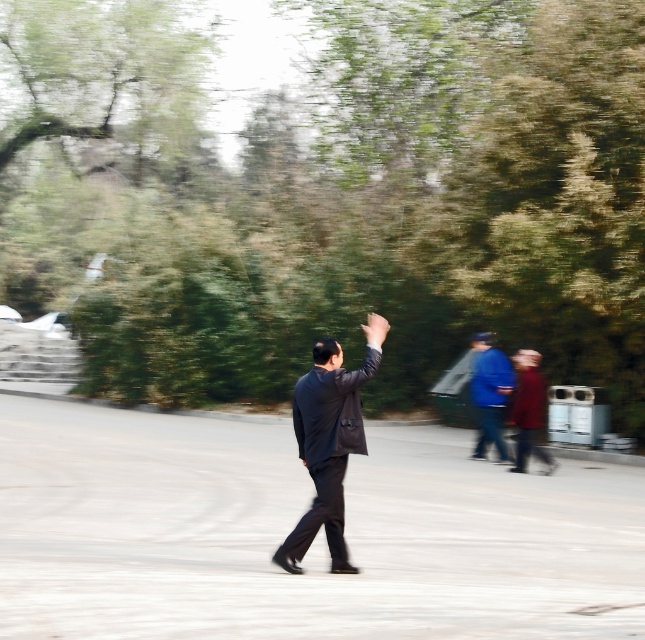
Who is higher up, dark blue suit at center or blue fabric jacket at center-right?

Positioned higher is dark blue suit at center.

Which is behind, point (324, 452) or point (482, 346)?

Point (482, 346)

Which is behind, point (339, 486) or point (493, 372)?

The point (493, 372) is more distant.

Find the location of a particular element. This screenshot has width=645, height=640. dark blue suit at center is located at coordinates (328, 442).